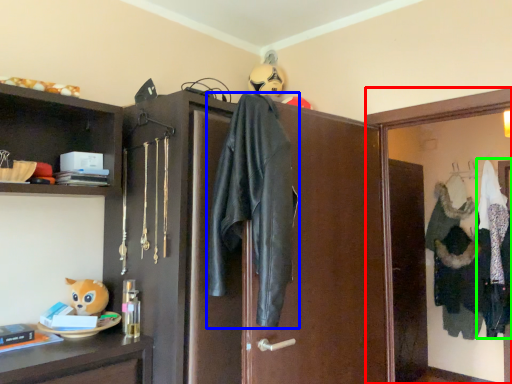
Question: Based on their relative distances, which object is farther from medicine cabinet (highlighted by a red box)? Choose from jacket (highlighted by a blue box) and clothing (highlighted by a green box).

Choices:
 (A) jacket
 (B) clothing

Answer: (B)